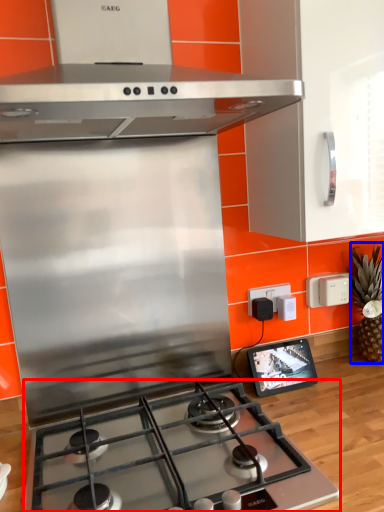
Question: Which point is further to the camera, gas stove (highlighted by a red box) or pineapple (highlighted by a blue box)?

Choices:
 (A) gas stove
 (B) pineapple

Answer: (B)